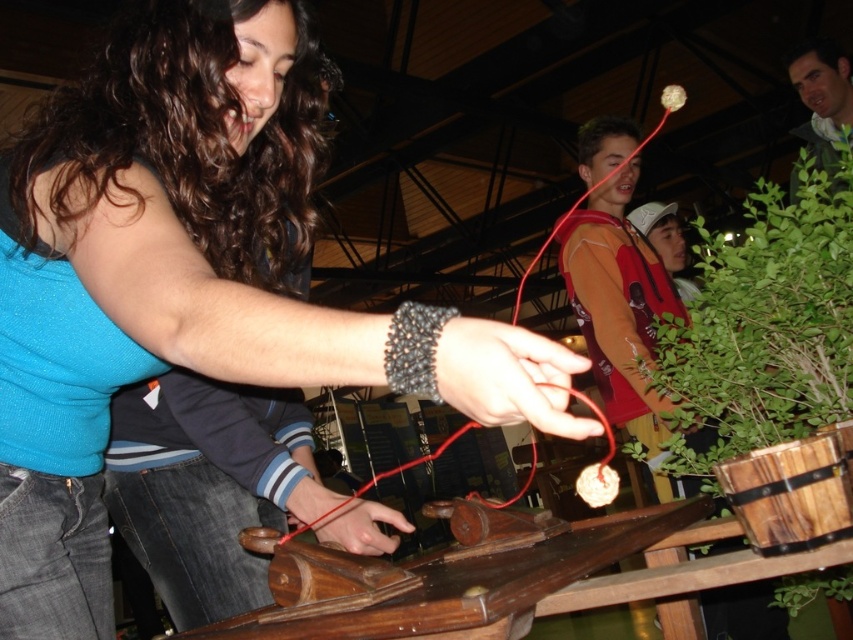
You are a photographer setting up for a photoshoot and need to ensure that the matte blue shirt at center and the green leafy plant at right are both visible in the frame. Given their heights, which object will require you to adjust your camera angle downward to capture it properly?

The matte blue shirt at center has a lesser height compared to the green leafy plant at right, so you will need to adjust the camera angle downward to capture the matte blue shirt at center properly.

You are a photographer trying to capture a closeup of the wooden contraption. You notice two points marked on the image at coordinates point [137,26] and point [822,419]. Which point should you focus on to ensure the closest part of the contraption is in sharp detail?

Point [137,26] is closer to the camera than point [822,419], so focusing on point [137,26] will ensure the closest part of the contraption is in sharp detail.

You are a photographer setting up for a group photo. You notice the matte blue shirt at center and the green leafy plant at right in the scene. To ensure both are visible in the photo, which object should you adjust the lighting to highlight more?

The matte blue shirt at center is positioned under green leafy plant at right, so you should adjust the lighting to highlight the matte blue shirt at center to ensure it is visible beneath the plant.